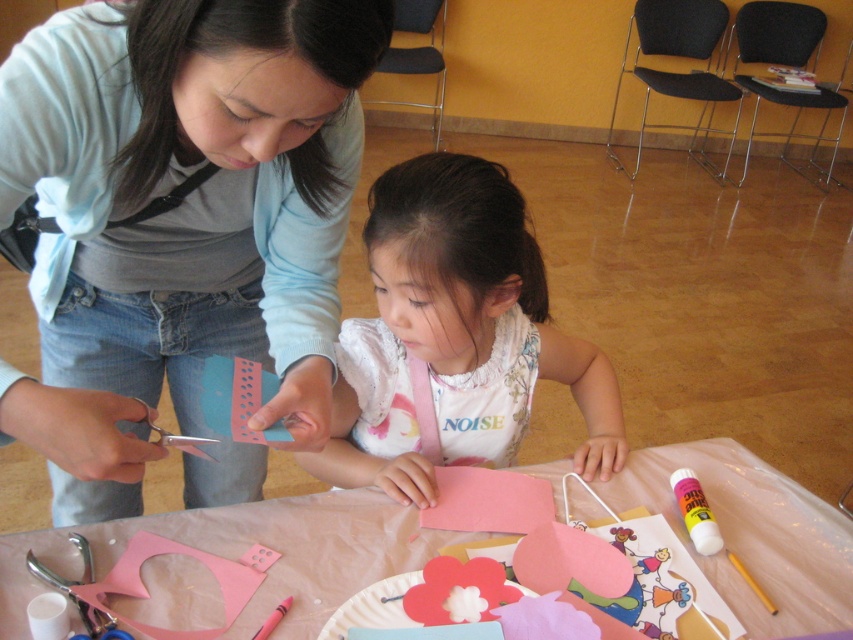
Based on the photo, is white cotton shirt at center below pink paper at center?

No, white cotton shirt at center is not below pink paper at center.

At what (x,y) coordinates should I click in order to perform the action: click on white cotton shirt at center. Please return your answer as a coordinate pair (x, y). The width and height of the screenshot is (853, 640). Looking at the image, I should click on (454, 337).

Does matte blue card at center have a lesser width compared to white cotton shirt at center?

In fact, matte blue card at center might be wider than white cotton shirt at center.

Is matte blue card at center to the right of white cotton shirt at center from the viewer's perspective?

Incorrect, matte blue card at center is not on the right side of white cotton shirt at center.

Is point (132, 356) positioned behind point (447, 273)?

Yes, point (132, 356) is behind point (447, 273).

The height and width of the screenshot is (640, 853). What are the coordinates of `matte blue card at center` in the screenshot? It's located at (178, 218).

Looking at this image, can you confirm if matte blue card at center is wider than pink paper at center?

No, matte blue card at center is not wider than pink paper at center.

Who is more forward, (x=96, y=234) or (x=329, y=573)?

Positioned in front is point (x=96, y=234).

I want to click on matte blue card at center, so click(x=178, y=218).